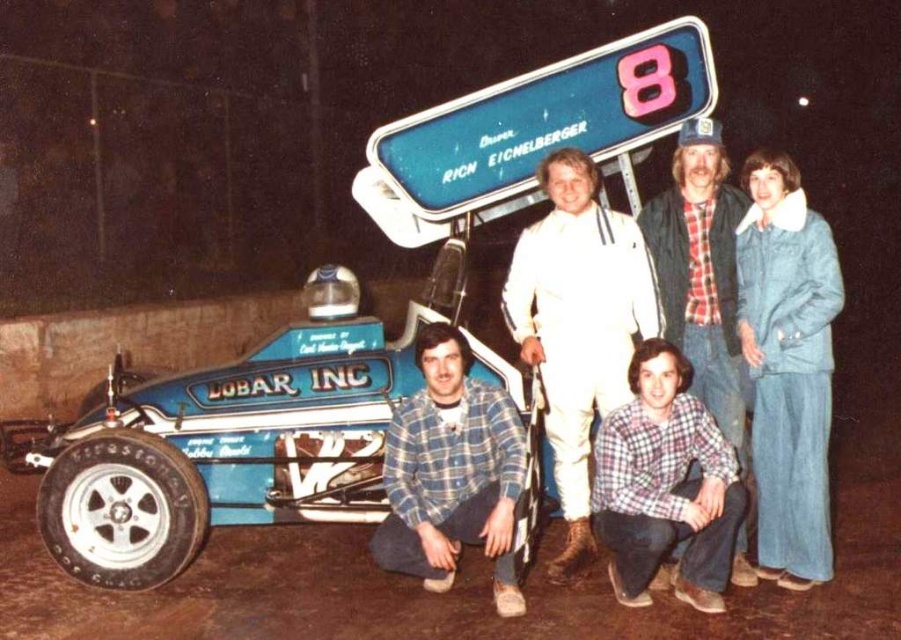
Question: Does blue metallic racecar at lower left have a lesser width compared to flannel shirt at center?

Choices:
 (A) no
 (B) yes

Answer: (A)

Question: Which object is positioned closest to the blue metallic racecar at lower left?

Choices:
 (A) white smooth suit at center
 (B) plaid flannel shirt at lower center
 (C) blue plaid shirt at lower center

Answer: (C)

Question: Which point is farther to the camera?

Choices:
 (A) flannel shirt at center
 (B) brown dirt track at lower center
 (C) blue denim jacket at upper right
 (D) plaid flannel shirt at lower center

Answer: (A)

Question: Which object is the closest to the plaid flannel shirt at lower center?

Choices:
 (A) blue plastic sign at upper center
 (B) flannel shirt at center

Answer: (B)

Question: Is blue metallic racecar at lower left above blue plaid shirt at lower center?

Choices:
 (A) yes
 (B) no

Answer: (A)

Question: Is blue denim jacket at upper right closer to the viewer compared to plaid flannel shirt at lower center?

Choices:
 (A) yes
 (B) no

Answer: (B)